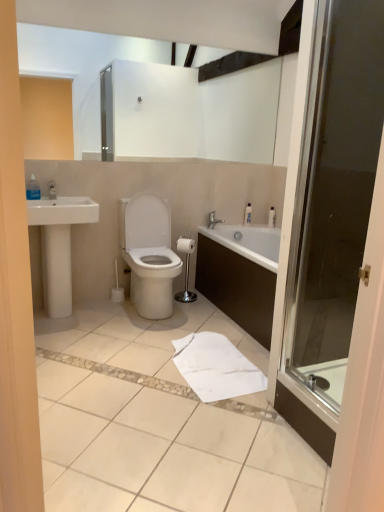
Question: From a real-world perspective, is white plastic bottle at upper right, positioned as the 2th toiletry in right-to-left order, above or below transparent glass shower door at right?

Choices:
 (A) below
 (B) above

Answer: (A)

Question: Relative to transparent glass shower door at right, is white plastic bottle at upper right, positioned as the second toiletry in front-to-back order, in front or behind?

Choices:
 (A) behind
 (B) front

Answer: (A)

Question: Which is farther from the transparent glass shower door at right?

Choices:
 (A) white plastic bottle at upper right, which is the 2th toiletry from back to front
 (B) white ceramic sink at left
 (C) transparent plastic bottle at upper left, the first toiletry viewed from the front
 (D) white plastic bottle at upper right, which is counted as the third toiletry, starting from the front
 (E) white paper towel at lower center

Answer: (C)

Question: Which is nearer to the white glossy toilet at center?

Choices:
 (A) white paper towel at lower center
 (B) white ceramic sink at left
 (C) white plastic bottle at upper right, which is counted as the third toiletry, starting from the front
 (D) white plastic bottle at upper right, positioned as the 2th toiletry in right-to-left order
 (E) transparent plastic bottle at upper left, marked as the 1th toiletry in a left-to-right arrangement

Answer: (B)